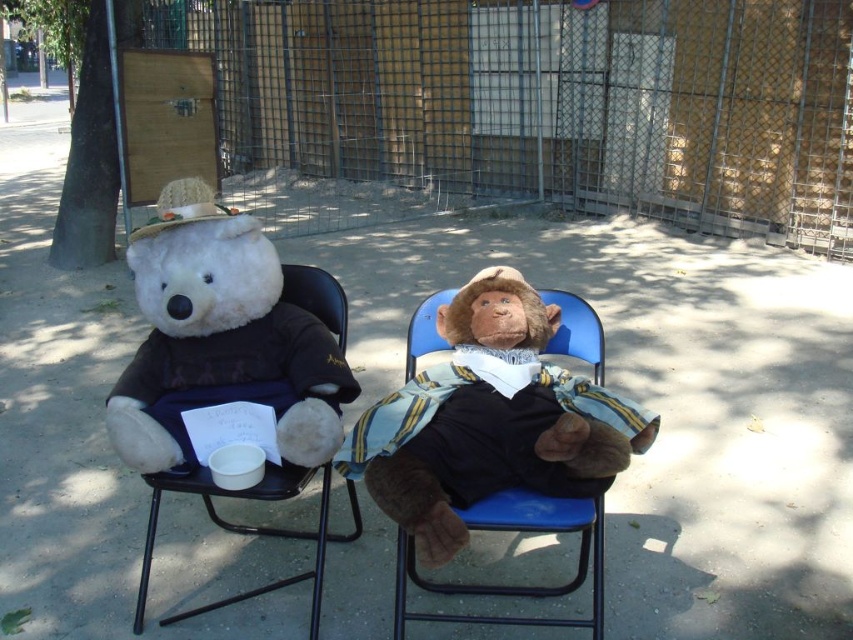
Is white plush bear at left closer to camera compared to black fabric chair at left?

Yes, white plush bear at left is closer to the viewer.

Between white plush bear at left and black fabric chair at left, which one is positioned lower?

black fabric chair at left is below.

Does point (193, 323) come farther from viewer compared to point (349, 541)?

No, (193, 323) is in front of (349, 541).

This screenshot has height=640, width=853. Identify the location of white plush bear at left. click(x=219, y=337).

Can you confirm if blue plastic chair at center is positioned below black fabric chair at left?

Indeed, blue plastic chair at center is positioned under black fabric chair at left.

Can you confirm if blue plastic chair at center is positioned above black fabric chair at left?

Incorrect, blue plastic chair at center is not positioned above black fabric chair at left.

You are a GUI agent. You are given a task and a screenshot of the screen. Output one action in this format:
    pyautogui.click(x=<x>, y=<y>)
    Task: Click on the blue plastic chair at center
    This screenshot has width=853, height=640.
    Given the screenshot: What is the action you would take?
    pyautogui.click(x=518, y=531)

The height and width of the screenshot is (640, 853). I want to click on blue plastic chair at center, so click(518, 531).

Between white plush bear at left and blue plastic chair at center, which one is positioned lower?

blue plastic chair at center is below.

Between point (134, 248) and point (521, 515), which one is positioned behind?

Positioned behind is point (134, 248).

Between point (183, 289) and point (422, 353), which one is positioned behind?

The point (422, 353) is more distant.

Locate an element on the screen. The width and height of the screenshot is (853, 640). white plush bear at left is located at coordinates (219, 337).